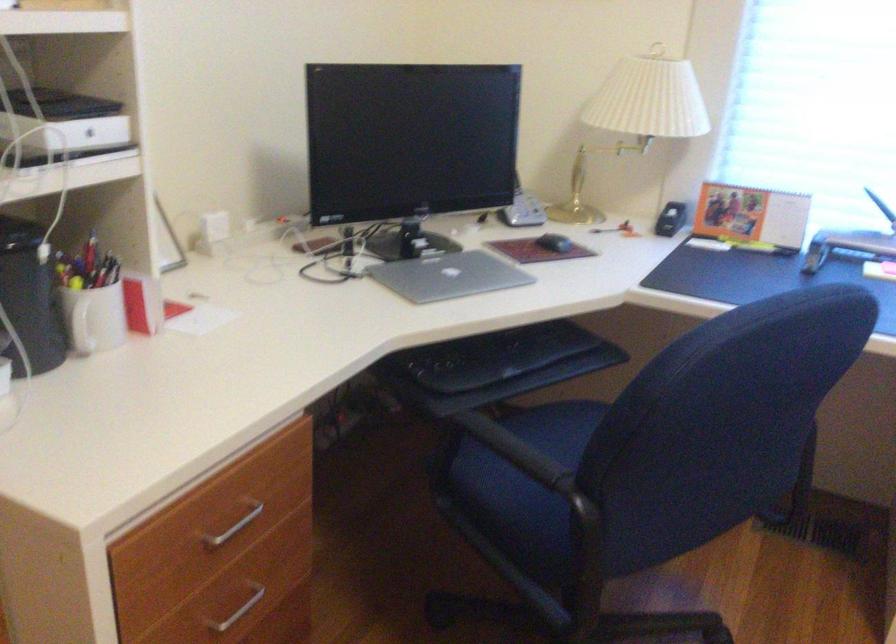
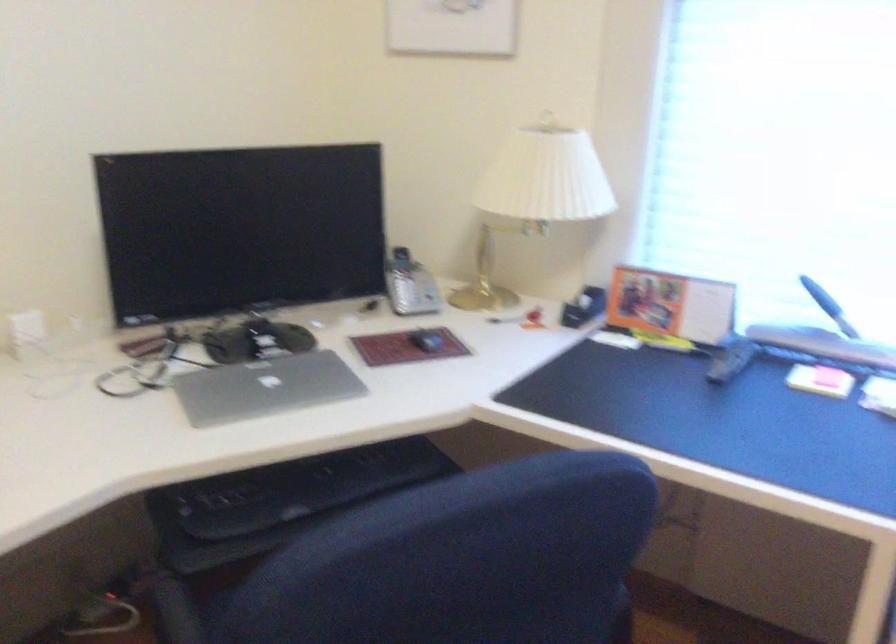
Question: The camera is either moving clockwise (left) or counter-clockwise (right) around the object. The first image is from the beginning of the video and the second image is from the end. Is the camera moving left or right when shooting the video?

Choices:
 (A) Left
 (B) Right

Answer: (B)